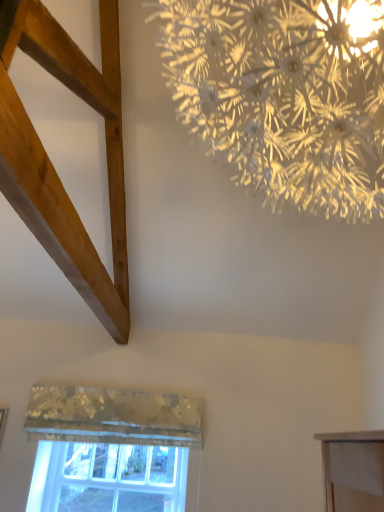
What is the approximate height of natural wood plank at upper left?

It is 5.95 feet.

Where is `natural wood plank at upper left`? This screenshot has width=384, height=512. natural wood plank at upper left is located at coordinates (50, 161).

What is the approximate height of metallic textured curtain at lower center?

The height of metallic textured curtain at lower center is 12.85 inches.

Identify the location of iridescent metallic chandelier at upper center. Image resolution: width=384 pixels, height=512 pixels. (285, 95).

Would you consider clear glass window at lower left to be distant from natural wood plank at upper left?

Indeed, clear glass window at lower left is not near natural wood plank at upper left.

Between clear glass window at lower left and natural wood plank at upper left, which one has larger width?

natural wood plank at upper left.

Locate an element on the screen. The width and height of the screenshot is (384, 512). plank on the right of clear glass window at lower left is located at coordinates (50, 161).

Does clear glass window at lower left have a lesser height compared to natural wood plank at upper left?

Yes, clear glass window at lower left is shorter than natural wood plank at upper left.

Does natural wood plank at upper left appear on the right side of clear glass window at lower left?

Indeed, natural wood plank at upper left is positioned on the right side of clear glass window at lower left.

Which is behind, point (7, 178) or point (119, 476)?

The point (119, 476) is behind.

Between natural wood plank at upper left and clear glass window at lower left, which one has smaller width?

Thinner between the two is clear glass window at lower left.

Is iridescent metallic chandelier at upper center not near natural wood plank at upper left?

Actually, iridescent metallic chandelier at upper center and natural wood plank at upper left are a little close together.

From the picture: From the image's perspective, between iridescent metallic chandelier at upper center and natural wood plank at upper left, which one is located above?

iridescent metallic chandelier at upper center, from the image's perspective.

Is iridescent metallic chandelier at upper center located outside natural wood plank at upper left?

iridescent metallic chandelier at upper center lies outside natural wood plank at upper left's area.

Identify the location of plank that appears on the left of iridescent metallic chandelier at upper center. The image size is (384, 512). (50, 161).

From the image's perspective, relative to metallic textured curtain at lower center, is natural wood plank at upper left above or below?

From the image's perspective, natural wood plank at upper left appears above metallic textured curtain at lower center.

Is metallic textured curtain at lower center at the back of natural wood plank at upper left?

That's not correct — natural wood plank at upper left is not looking away from metallic textured curtain at lower center.

Considering the sizes of objects natural wood plank at upper left and metallic textured curtain at lower center in the image provided, who is taller, natural wood plank at upper left or metallic textured curtain at lower center?

Standing taller between the two is natural wood plank at upper left.

Does natural wood plank at upper left have a larger size compared to metallic textured curtain at lower center?

Indeed, natural wood plank at upper left has a larger size compared to metallic textured curtain at lower center.

Is clear glass window at lower left in front of metallic textured curtain at lower center?

No, clear glass window at lower left is behind metallic textured curtain at lower center.

Is clear glass window at lower left beside metallic textured curtain at lower center?

clear glass window at lower left and metallic textured curtain at lower center are clearly separated.

Does point (84, 444) lie in front of point (89, 431)?

No, (84, 444) is behind (89, 431).

Does clear glass window at lower left have a greater height compared to metallic textured curtain at lower center?

Yes, clear glass window at lower left is taller than metallic textured curtain at lower center.

Identify the location of flower above the clear glass window at lower left (from a real-world perspective). (285, 95).

Measure the distance between clear glass window at lower left and iridescent metallic chandelier at upper center.

clear glass window at lower left is 2.70 meters from iridescent metallic chandelier at upper center.

Which of these two, clear glass window at lower left or iridescent metallic chandelier at upper center, is thinner?

With smaller width is clear glass window at lower left.

Choose the correct answer: Is clear glass window at lower left inside iridescent metallic chandelier at upper center or outside it?

clear glass window at lower left is located beyond the bounds of iridescent metallic chandelier at upper center.

From the image's perspective, would you say iridescent metallic chandelier at upper center is positioned over clear glass window at lower left?

Yes, from the image's perspective, iridescent metallic chandelier at upper center is above clear glass window at lower left.

Is point (333, 200) positioned after point (52, 493)?

No, it is in front of (52, 493).

Is iridescent metallic chandelier at upper center to the left or to the right of clear glass window at lower left in the image?

From the image, it's evident that iridescent metallic chandelier at upper center is to the right of clear glass window at lower left.

Where is `plank lying above the clear glass window at lower left (from the image's perspective)`? The width and height of the screenshot is (384, 512). plank lying above the clear glass window at lower left (from the image's perspective) is located at coordinates (50, 161).

Find the location of a particular element. The width and height of the screenshot is (384, 512). window screen on the left of natural wood plank at upper left is located at coordinates (115, 478).

From the image, which object appears to be farther from clear glass window at lower left, metallic textured curtain at lower center or natural wood plank at upper left?

Among the two, natural wood plank at upper left is located further to clear glass window at lower left.

Which object lies further to the anchor point iridescent metallic chandelier at upper center, natural wood plank at upper left or metallic textured curtain at lower center?

Based on the image, metallic textured curtain at lower center appears to be further to iridescent metallic chandelier at upper center.

From the image, which object appears to be nearer to natural wood plank at upper left, iridescent metallic chandelier at upper center or metallic textured curtain at lower center?

iridescent metallic chandelier at upper center lies closer to natural wood plank at upper left than the other object.

Based on their spatial positions, is clear glass window at lower left or iridescent metallic chandelier at upper center further from metallic textured curtain at lower center?

Based on the image, iridescent metallic chandelier at upper center appears to be further to metallic textured curtain at lower center.

From the image, which object appears to be farther from clear glass window at lower left, iridescent metallic chandelier at upper center or natural wood plank at upper left?

Among the two, iridescent metallic chandelier at upper center is located further to clear glass window at lower left.

Estimate the real-world distances between objects in this image. Which object is further from natural wood plank at upper left, metallic textured curtain at lower center or iridescent metallic chandelier at upper center?

metallic textured curtain at lower center.

Estimate the real-world distances between objects in this image. Which object is further from clear glass window at lower left, metallic textured curtain at lower center or iridescent metallic chandelier at upper center?

iridescent metallic chandelier at upper center is positioned further to the anchor clear glass window at lower left.

When comparing their distances from metallic textured curtain at lower center, does natural wood plank at upper left or clear glass window at lower left seem further?

natural wood plank at upper left lies further to metallic textured curtain at lower center than the other object.

The image size is (384, 512). I want to click on curtain that lies between natural wood plank at upper left and clear glass window at lower left from top to bottom, so click(113, 416).

Locate an element on the screen. The height and width of the screenshot is (512, 384). curtain between iridescent metallic chandelier at upper center and clear glass window at lower left in the front-back direction is located at coordinates (113, 416).

Identify the location of plank located between iridescent metallic chandelier at upper center and metallic textured curtain at lower center in the depth direction. (50, 161).

You are a GUI agent. You are given a task and a screenshot of the screen. Output one action in this format:
    pyautogui.click(x=<x>, y=<y>)
    Task: Click on the plank between iridescent metallic chandelier at upper center and clear glass window at lower left in the up-down direction
    
    Given the screenshot: What is the action you would take?
    click(x=50, y=161)